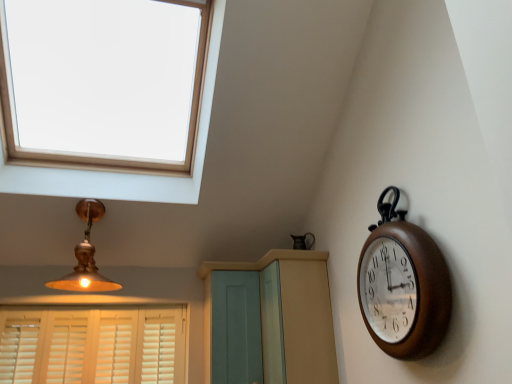
Question: Choose the correct answer: Is brown wooden clock at right inside light blue wood screen door at center or outside it?

Choices:
 (A) inside
 (B) outside

Answer: (B)

Question: In the image, is brown wooden clock at right positioned in front of or behind light blue wood screen door at center?

Choices:
 (A) front
 (B) behind

Answer: (A)

Question: Which of these objects is positioned farthest from the white wood blinds at lower left?

Choices:
 (A) light blue wood dresser at center
 (B) matte gold lampshade at upper left
 (C) brown wooden clock at right
 (D) light blue wood screen door at center

Answer: (C)

Question: Which object is the farthest from the light blue wood dresser at center?

Choices:
 (A) matte gold lampshade at upper left
 (B) light blue wood screen door at center
 (C) brown wooden clock at right
 (D) white wood blinds at lower left

Answer: (A)